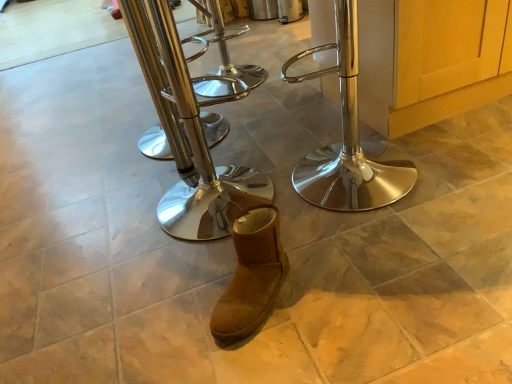
The image size is (512, 384). I want to click on unoccupied space behind brown suede boot at center, so click(x=232, y=247).